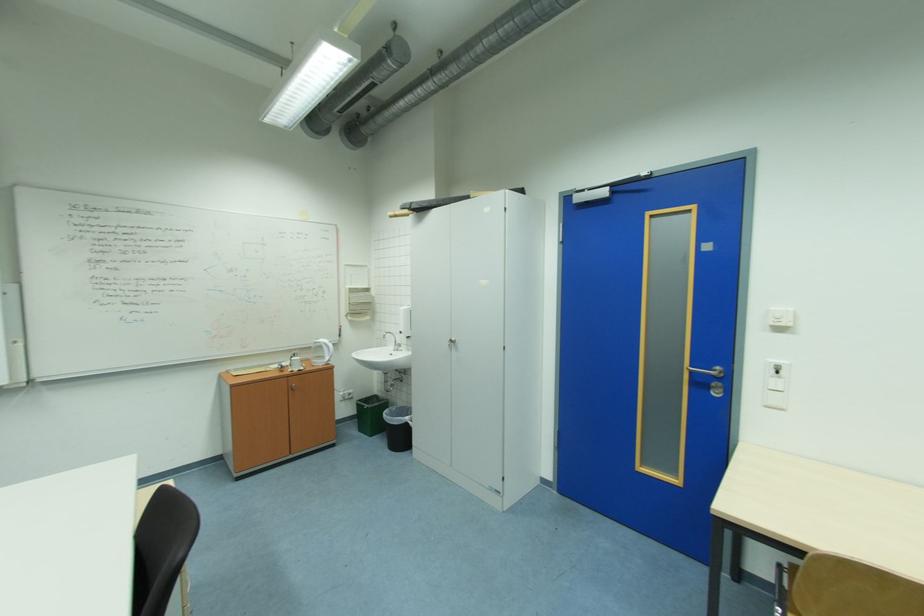
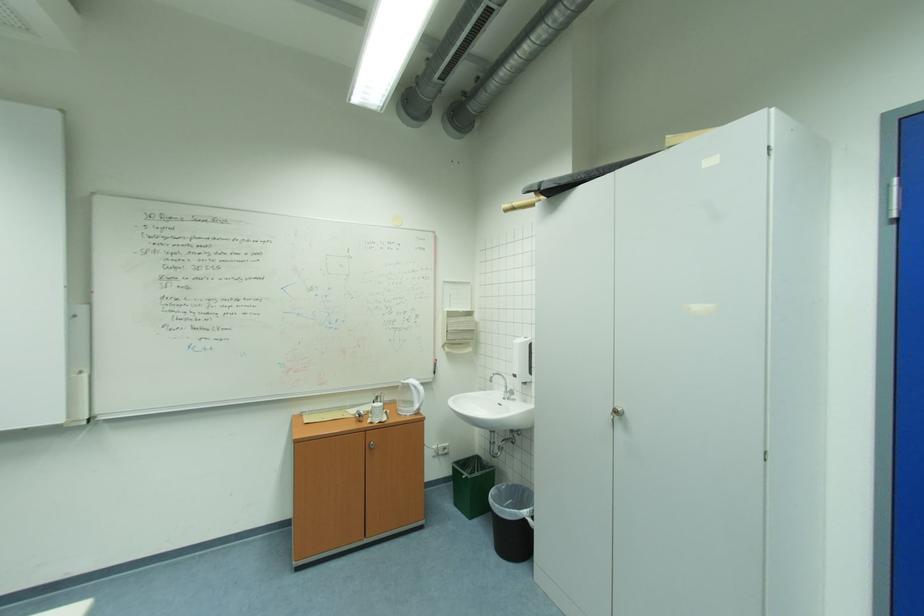
Locate, in the second image, the point that corresponds to point (407, 333) in the first image.

(523, 377)